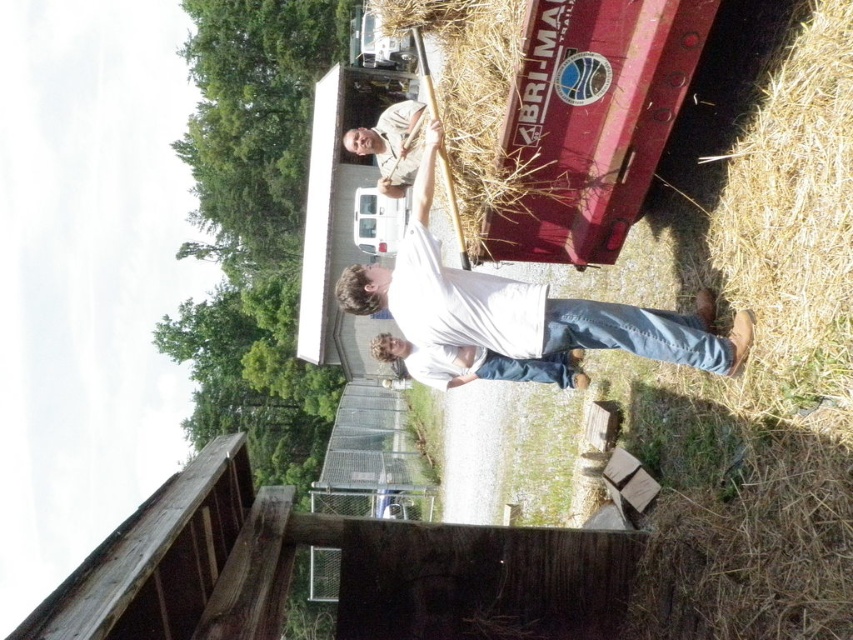
Is the position of white cotton shirt at center less distant than that of camouflage shirt at upper center?

Yes, it is.

The height and width of the screenshot is (640, 853). Describe the element at coordinates (524, 305) in the screenshot. I see `white cotton shirt at center` at that location.

Where is `white cotton shirt at center`? white cotton shirt at center is located at coordinates (524, 305).

Which is below, denim jeans at lower right or camouflage shirt at upper center?

denim jeans at lower right is lower down.

Who is more forward, (x=695, y=323) or (x=395, y=173)?

Point (x=695, y=323)

Locate an element on the screen. denim jeans at lower right is located at coordinates (631, 333).

Is light brown straw at lower right taller than camouflage shirt at upper center?

In fact, light brown straw at lower right may be shorter than camouflage shirt at upper center.

Between light brown straw at lower right and camouflage shirt at upper center, which one has more height?

camouflage shirt at upper center is taller.

Describe the element at coordinates (759, 353) in the screenshot. This screenshot has width=853, height=640. I see `light brown straw at lower right` at that location.

Image resolution: width=853 pixels, height=640 pixels. I want to click on light brown straw at lower right, so click(759, 353).